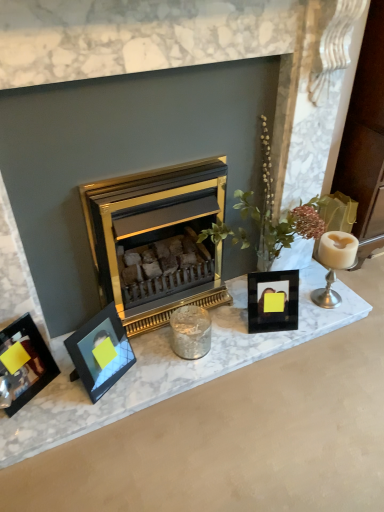
Question: Considering the relative sizes of gold metallic fireplace at center and white glossy candle holder at right, which appears as the second candle holder when viewed from the left, in the image provided, is gold metallic fireplace at center taller than white glossy candle holder at right, which appears as the second candle holder when viewed from the left,?

Choices:
 (A) no
 (B) yes

Answer: (B)

Question: Is gold metallic fireplace at center aimed at white glossy candle holder at right, which is the first candle holder from right to left?

Choices:
 (A) yes
 (B) no

Answer: (A)

Question: From a real-world perspective, is gold metallic fireplace at center physically above white glossy candle holder at right, which appears as the second candle holder when viewed from the left?

Choices:
 (A) no
 (B) yes

Answer: (B)

Question: From a real-world perspective, is gold metallic fireplace at center beneath white glossy candle holder at right, which is the first candle holder from right to left?

Choices:
 (A) yes
 (B) no

Answer: (B)

Question: Is the depth of gold metallic fireplace at center greater than that of white glossy candle holder at right, which appears as the second candle holder when viewed from the left?

Choices:
 (A) no
 (B) yes

Answer: (A)

Question: From their relative heights in the image, would you say gold metallic fireplace at center is taller or shorter than gold metallic wood burning stove at center?

Choices:
 (A) tall
 (B) short

Answer: (A)

Question: From the image's perspective, is gold metallic fireplace at center located above or below gold metallic wood burning stove at center?

Choices:
 (A) above
 (B) below

Answer: (A)

Question: Does point (274, 111) appear closer or farther from the camera than point (205, 215)?

Choices:
 (A) closer
 (B) farther

Answer: (A)

Question: In the image, is gold metallic fireplace at center positioned in front of or behind gold metallic wood burning stove at center?

Choices:
 (A) behind
 (B) front

Answer: (B)

Question: Is silver metallic candle holder at center, marked as the first candle holder in a left-to-right arrangement, bigger or smaller than gold metallic fireplace at center?

Choices:
 (A) big
 (B) small

Answer: (B)

Question: Is silver metallic candle holder at center, marked as the first candle holder in a left-to-right arrangement, inside or outside of gold metallic fireplace at center?

Choices:
 (A) inside
 (B) outside

Answer: (B)

Question: Is silver metallic candle holder at center, the second candle holder positioned from the right, wider or thinner than gold metallic fireplace at center?

Choices:
 (A) wide
 (B) thin

Answer: (B)

Question: From a real-world perspective, is silver metallic candle holder at center, the second candle holder positioned from the right, above or below gold metallic fireplace at center?

Choices:
 (A) below
 (B) above

Answer: (A)

Question: Does point (19, 321) appear closer or farther from the camera than point (125, 344)?

Choices:
 (A) closer
 (B) farther

Answer: (A)

Question: Is metallic silver photo frame at left, which is counted as the 3th picture frame, starting from the right, taller or shorter than matte black picture frame at left, which is the second picture frame in left-to-right order?

Choices:
 (A) tall
 (B) short

Answer: (A)